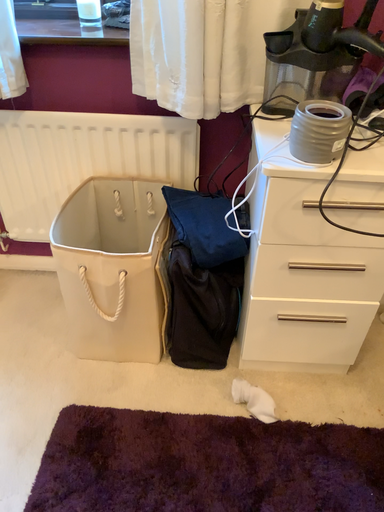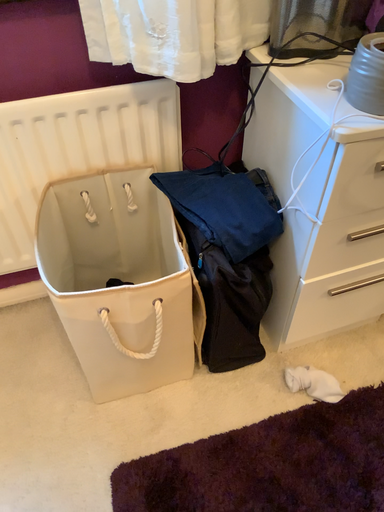
Question: Which way did the camera rotate in the video?

Choices:
 (A) rotated right
 (B) rotated left

Answer: (A)